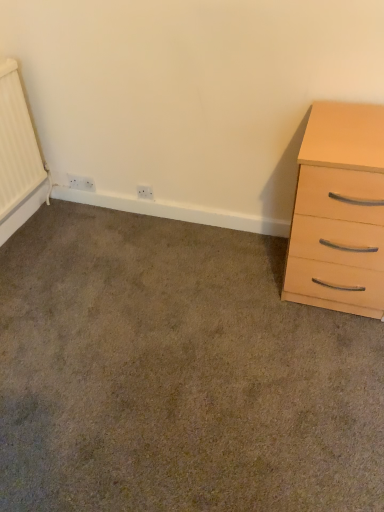
Question: In terms of height, does light wood/veneer chest of drawers at right look taller or shorter compared to white plastic electric outlet at lower left, the 2th electric outlet positioned from the front?

Choices:
 (A) tall
 (B) short

Answer: (A)

Question: From a real-world perspective, is light wood/veneer chest of drawers at right physically located above or below white plastic electric outlet at lower left, which appears as the 1th electric outlet when viewed from the back?

Choices:
 (A) below
 (B) above

Answer: (B)

Question: Which object is the closest to the white plastic electric outlet at lower left, the 2th electric outlet positioned from the front?

Choices:
 (A) carpet at lower left
 (B) light wood/veneer chest of drawers at right
 (C) white plastic electric outlet at center, the 1th electric outlet viewed from the front

Answer: (C)

Question: Estimate the real-world distances between objects in this image. Which object is closer to the white plastic electric outlet at center, which appears as the 1th electric outlet when viewed from the right?

Choices:
 (A) light wood/veneer chest of drawers at right
 (B) carpet at lower left
 (C) white plastic electric outlet at lower left, acting as the second electric outlet starting from the right

Answer: (C)